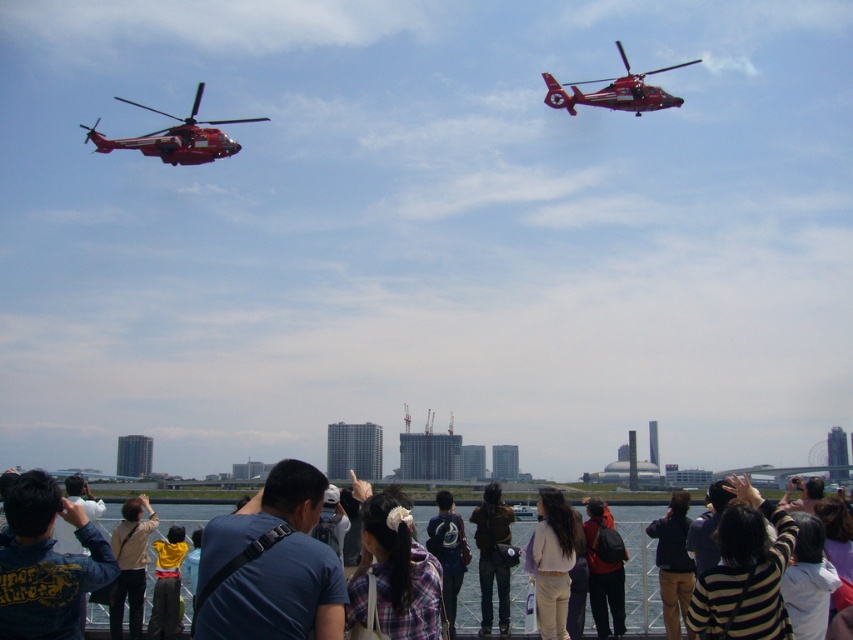
Question: Is denim jacket at lower left bigger than plaid fabric hairband at center?

Choices:
 (A) yes
 (B) no

Answer: (A)

Question: Among these objects, which one is farthest from the camera?

Choices:
 (A) dark brown leather jacket at center
 (B) light brown hair at center

Answer: (A)

Question: Which object is the farthest from the matte black backpack at center?

Choices:
 (A) light brown hair at center
 (B) light brown leather jacket at lower left
 (C) dark blue backpack at center

Answer: (B)

Question: Can you confirm if metallic red helicopter at upper left is positioned below metallic red helicopter at upper right?

Choices:
 (A) yes
 (B) no

Answer: (A)

Question: Does denim jacket at lower left appear on the right side of dark brown leather jacket at center?

Choices:
 (A) no
 (B) yes

Answer: (A)

Question: Considering the real-world distances, which object is farthest from the light brown leather jacket at lower left?

Choices:
 (A) metallic red helicopter at upper left
 (B) dark brown leather jacket at center
 (C) matte black backpack at center
 (D) denim jacket at lower left

Answer: (A)